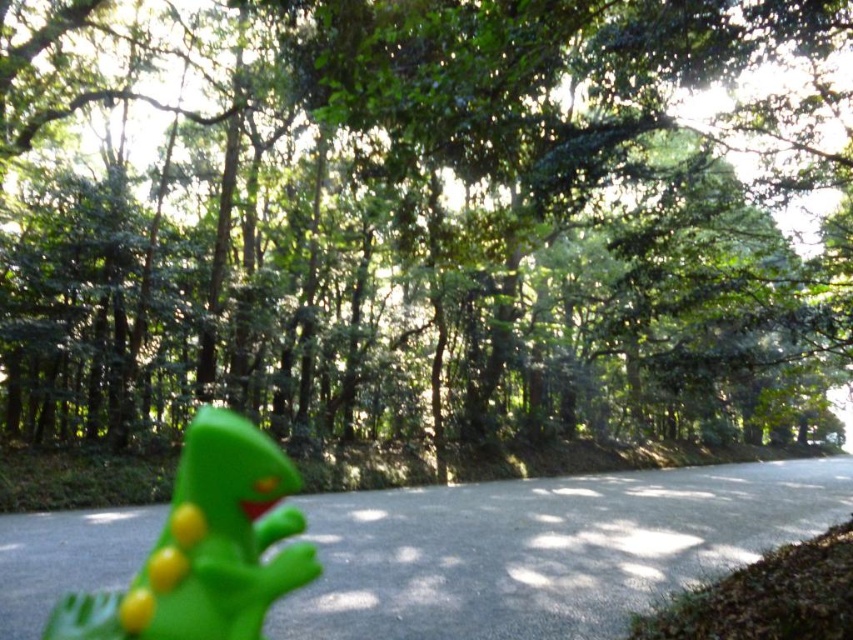
Can you confirm if green matte tree at center is taller than green rubber toy at lower left?

Correct, green matte tree at center is much taller as green rubber toy at lower left.

Does point (281, 332) lie in front of point (120, 609)?

No, it is not.

Identify the location of green matte tree at center. The image size is (853, 640). (424, 220).

Where is `green matte tree at center`? The image size is (853, 640). green matte tree at center is located at coordinates (424, 220).